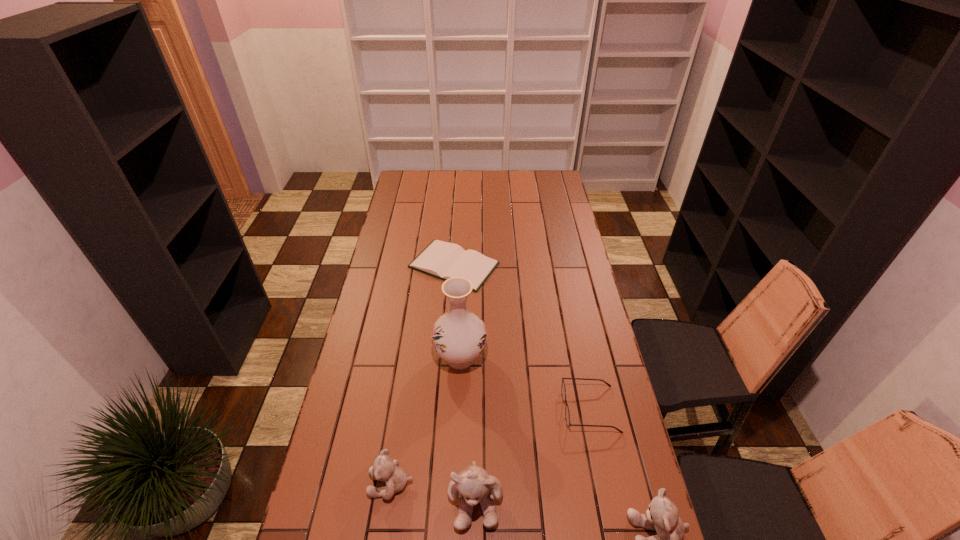
I want to click on free point between the fourth tallest object and the farthest object, so click(x=422, y=375).

The width and height of the screenshot is (960, 540). In order to click on vacant region between the fourth tallest object and the fifth tallest object in this screenshot , I will do `click(491, 447)`.

This screenshot has width=960, height=540. What are the coordinates of `object that is the closest to the second shortest teddy bear` in the screenshot? It's located at (567, 415).

Identify the location of the second closest object to the farthest object. The image size is (960, 540). (567, 415).

Find the location of `teddy bear that is the third nearest to the hardback book`. teddy bear that is the third nearest to the hardback book is located at coordinates (662, 516).

Find the location of a particular element. The width and height of the screenshot is (960, 540). the second closest teddy bear to the second teddy bear from left to right is located at coordinates (662, 516).

Where is `vacant space that satisfies the following two spatial constraints: 1. on the front-facing side of the third farthest object; 2. on the face of the second teddy bear from right to left`? vacant space that satisfies the following two spatial constraints: 1. on the front-facing side of the third farthest object; 2. on the face of the second teddy bear from right to left is located at coordinates (609, 499).

Locate an element on the screen. The image size is (960, 540). vacant space that satisfies the following two spatial constraints: 1. on the front side of the tallest object; 2. on the face of the leftmost teddy bear is located at coordinates (455, 484).